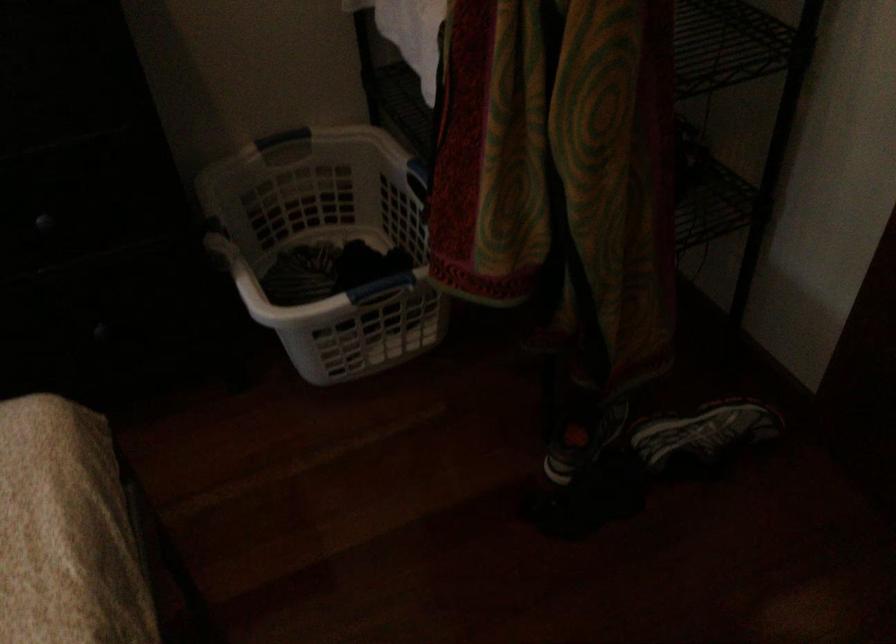
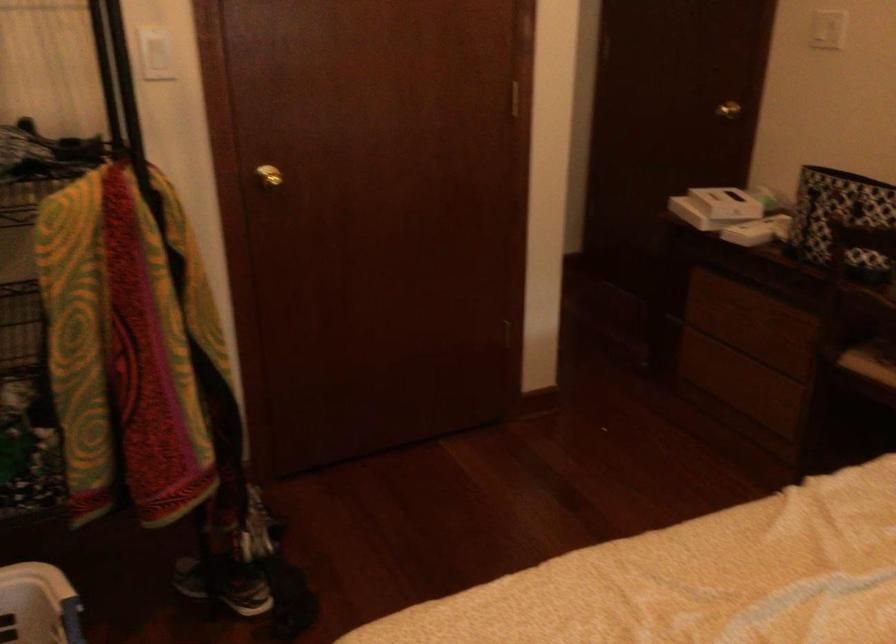
Locate, in the second image, the point that corresponds to the point at 393,277 in the first image.

(63, 616)